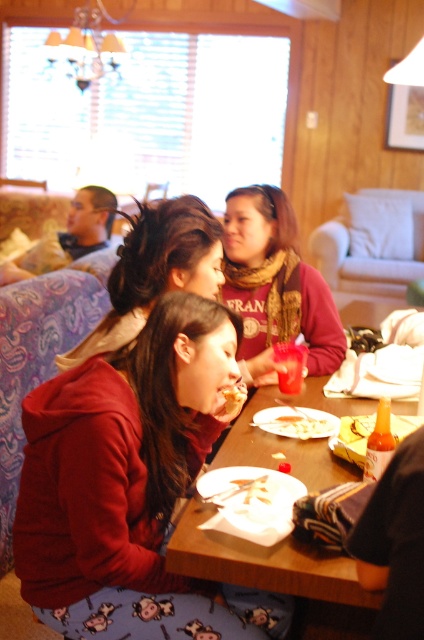
You are standing at the center of the image. Which direction should you move to reach the matte red hoodie at lower left?

The matte red hoodie at lower left is located at coordinates 0.761 on the x axis and 0.309 on the y axis. Since you are at the center, you should move to the left and down to reach it.

Please look at the image and identify the object located at the coordinates point (276, 280). The scene includes three people sitting around a wooden dining table with a couch and sofa in the background. The objects present are the matte red sweater at center. What is the object at those coordinates?

The object at point (276, 280) is the matte red sweater at center.

You are a waiter in a restaurant and need to deliver a dessert plate to the table. The dessert plate must be placed exactly between the matte red sweater at center and the golden crispy chicken at lower center. What is the minimum distance you should measure from each object to ensure the plate is centered?

The matte red sweater at center is 26.55 inches away from the golden crispy chicken at lower center. To center the dessert plate between them, you should measure 13.275 inches from each object.